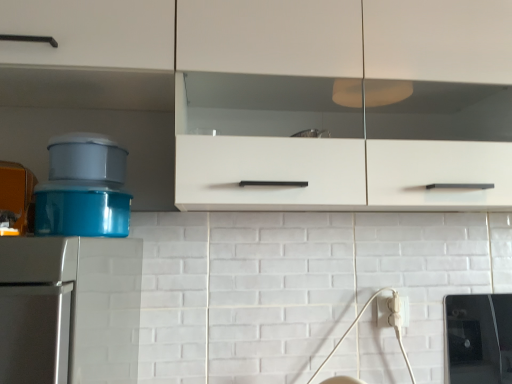
What is the approximate height of white matte cabinet at upper center?

white matte cabinet at upper center is 11.73 inches tall.

This screenshot has height=384, width=512. Identify the location of white matte cabinet at upper center. (90, 33).

Image resolution: width=512 pixels, height=384 pixels. Describe the element at coordinates (90, 33) in the screenshot. I see `white matte cabinet at upper center` at that location.

What is the approximate width of white matte cabinet at upper center?

The width of white matte cabinet at upper center is 29.57 centimeters.

Where is `white plastic electric outlet at lower right`? white plastic electric outlet at lower right is located at coordinates (383, 308).

What do you see at coordinates (383, 308) in the screenshot?
I see `white plastic electric outlet at lower right` at bounding box center [383, 308].

What is the approximate width of white plastic electric outlet at lower right?

white plastic electric outlet at lower right is 0.64 inches in width.

Identify the location of white matte cabinet at upper center. (90, 33).

Considering the relative positions of white plastic electric outlet at lower right and white matte cabinet at upper center in the image provided, is white plastic electric outlet at lower right to the left or to the right of white matte cabinet at upper center?

white plastic electric outlet at lower right is positioned on white matte cabinet at upper center's right side.

Is the position of white plastic electric outlet at lower right less distant than that of white matte cabinet at upper center?

No, the depth of white plastic electric outlet at lower right is greater than that of white matte cabinet at upper center.

Considering the positions of point (385, 323) and point (147, 9), is point (385, 323) closer or farther from the camera than point (147, 9)?

Clearly, point (385, 323) is more distant from the camera than point (147, 9).

From the image's perspective, is white plastic electric outlet at lower right over white matte cabinet at upper center?

Incorrect, from the image's perspective, white plastic electric outlet at lower right is lower than white matte cabinet at upper center.

From a real-world perspective, relative to white matte cabinet at upper center, is white plastic electric outlet at lower right vertically above or below?

From a real-world perspective, white plastic electric outlet at lower right is physically below white matte cabinet at upper center.

From the picture: Considering the sizes of white plastic electric outlet at lower right and white matte cabinet at upper center in the image, is white plastic electric outlet at lower right wider or thinner than white matte cabinet at upper center?

In the image, white plastic electric outlet at lower right appears to be more narrow than white matte cabinet at upper center.

Which of these two, white plastic electric outlet at lower right or white matte cabinet at upper center, stands taller?

white matte cabinet at upper center is taller.

Can you confirm if white plastic electric outlet at lower right is bigger than white matte cabinet at upper center?

Incorrect, white plastic electric outlet at lower right is not larger than white matte cabinet at upper center.

Would you say white plastic electric outlet at lower right is outside white matte cabinet at upper center?

Absolutely, white plastic electric outlet at lower right is external to white matte cabinet at upper center.

Does white plastic electric outlet at lower right touch white matte cabinet at upper center?

white plastic electric outlet at lower right and white matte cabinet at upper center are not in contact.

Is white plastic electric outlet at lower right looking in the opposite direction of white matte cabinet at upper center?

white plastic electric outlet at lower right is not turned away from white matte cabinet at upper center.

Based on the photo, how different are the orientations of white plastic electric outlet at lower right and white matte cabinet at upper center in degrees?

There is a 0.278-degree angle between the facing directions of white plastic electric outlet at lower right and white matte cabinet at upper center.

How distant is white plastic electric outlet at lower right from white matte cabinet at upper center?

white plastic electric outlet at lower right and white matte cabinet at upper center are 37.21 inches apart from each other.

You are a GUI agent. You are given a task and a screenshot of the screen. Output one action in this format:
    pyautogui.click(x=<x>, y=<y>)
    Task: Click on the cabinetry located above the white plastic electric outlet at lower right (from the image's perspective)
    Image resolution: width=512 pixels, height=384 pixels.
    Given the screenshot: What is the action you would take?
    pyautogui.click(x=90, y=33)

From the picture: Which is more to the left, white matte cabinet at upper center or white plastic electric outlet at lower right?

A: From the viewer's perspective, white matte cabinet at upper center appears more on the left side.

Does white matte cabinet at upper center lie in front of white plastic electric outlet at lower right?

Yes, it is in front of white plastic electric outlet at lower right.

Does point (75, 60) come in front of point (379, 298)?

Yes, it is.

From the image's perspective, is white matte cabinet at upper center over white plastic electric outlet at lower right?

Yes.

From a real-world perspective, who is located higher, white matte cabinet at upper center or white plastic electric outlet at lower right?

white matte cabinet at upper center, from a real-world perspective.

Between white matte cabinet at upper center and white plastic electric outlet at lower right, which one has smaller width?

Thinner between the two is white plastic electric outlet at lower right.

Does white matte cabinet at upper center have a lesser height compared to white plastic electric outlet at lower right?

In fact, white matte cabinet at upper center may be taller than white plastic electric outlet at lower right.

Can you confirm if white matte cabinet at upper center is bigger than white plastic electric outlet at lower right?

Yes, white matte cabinet at upper center is bigger than white plastic electric outlet at lower right.

Is white plastic electric outlet at lower right surrounded by white matte cabinet at upper center?

Actually, white plastic electric outlet at lower right is outside white matte cabinet at upper center.

Is white matte cabinet at upper center placed right next to white plastic electric outlet at lower right?

No, white matte cabinet at upper center is not next to white plastic electric outlet at lower right.

Is white matte cabinet at upper center facing towards white plastic electric outlet at lower right?

No, white matte cabinet at upper center is not turned towards white plastic electric outlet at lower right.

Measure the distance from white matte cabinet at upper center to white plastic electric outlet at lower right.

They are 37.21 inches apart.

Locate an element on the screen. cabinetry that is in front of the white plastic electric outlet at lower right is located at coordinates (90, 33).

Where is `cabinetry in front of the white plastic electric outlet at lower right`? The height and width of the screenshot is (384, 512). cabinetry in front of the white plastic electric outlet at lower right is located at coordinates (90, 33).

Find the location of a particular element. The width and height of the screenshot is (512, 384). cabinetry on the left of white plastic electric outlet at lower right is located at coordinates (90, 33).